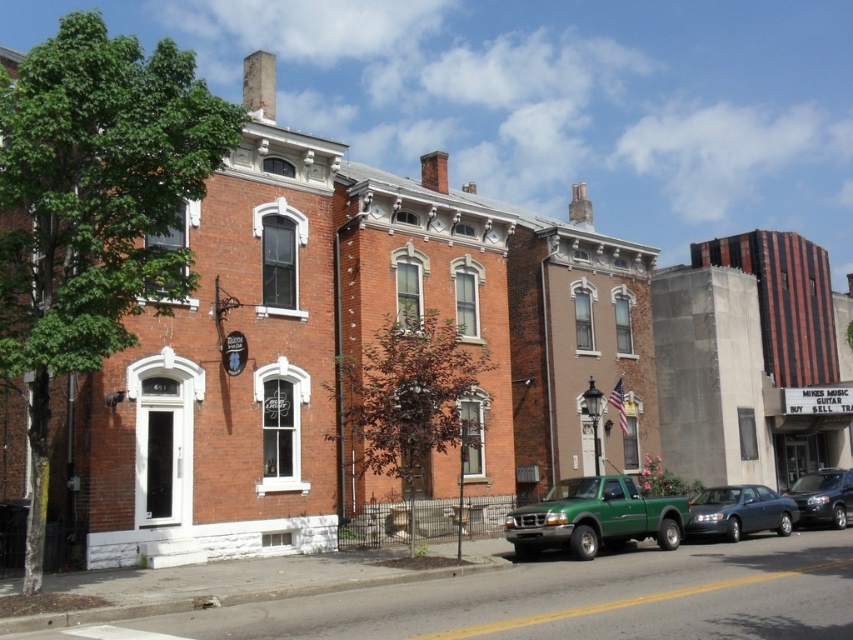
You are a delivery person trying to park your 2.5 meter wide van between the metallic gray sedan at lower right and the shiny black suv at center right. Can your van fit in that space?

The metallic gray sedan at lower right is narrower than the shiny black suv at center right, but the space between them depends on their positions. Since the description only provides information about their widths and not the distance between them, it is impossible to determine if the van will fit based on the given information.

Based on the photo, you are a delivery person needing to park your 5.5 meter long truck between the green matte truck at lower center and the shiny black suv at center right. Can you fit your truck in the space between them?

The distance between the green matte truck at lower center and the shiny black suv at center right is 13.58 meters. Since your truck is 5.5 meters long, there is enough space to park between them as the available space is significantly larger than the truck length.